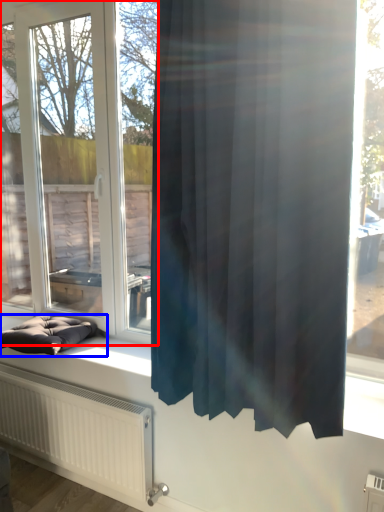
Question: Which object is closer to the camera taking this photo, window (highlighted by a red box) or furniture (highlighted by a blue box)?

Choices:
 (A) window
 (B) furniture

Answer: (A)